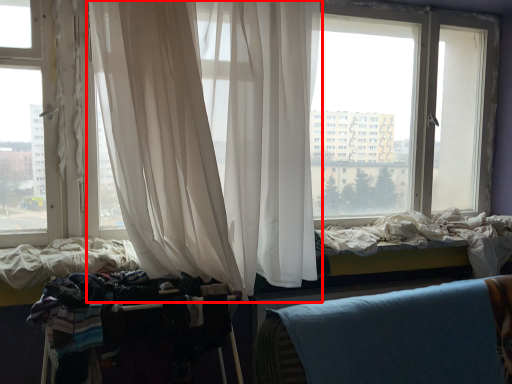
Question: From the image, what is the correct spatial relationship of curtain (annotated by the red box) in relation to baby carriage?

Choices:
 (A) left
 (B) right

Answer: (B)